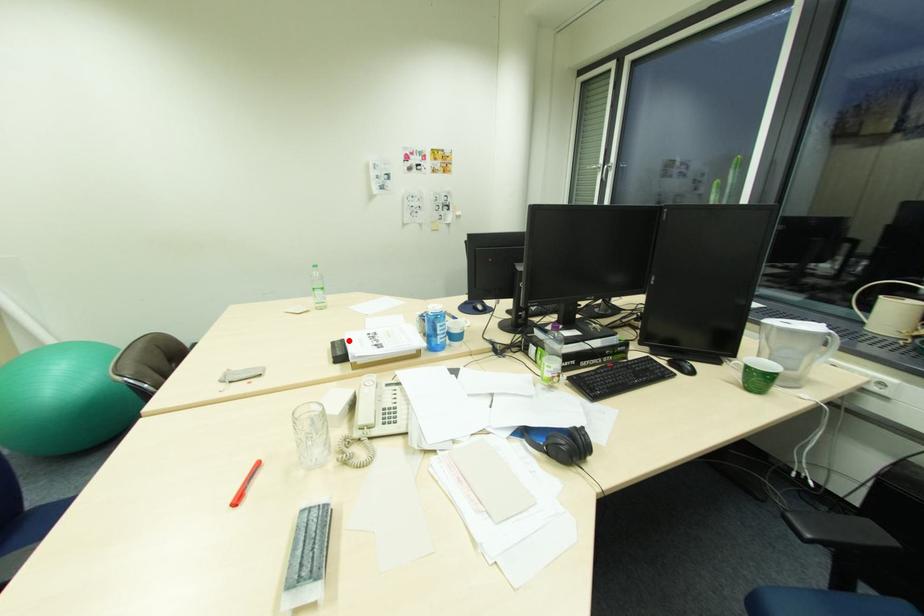
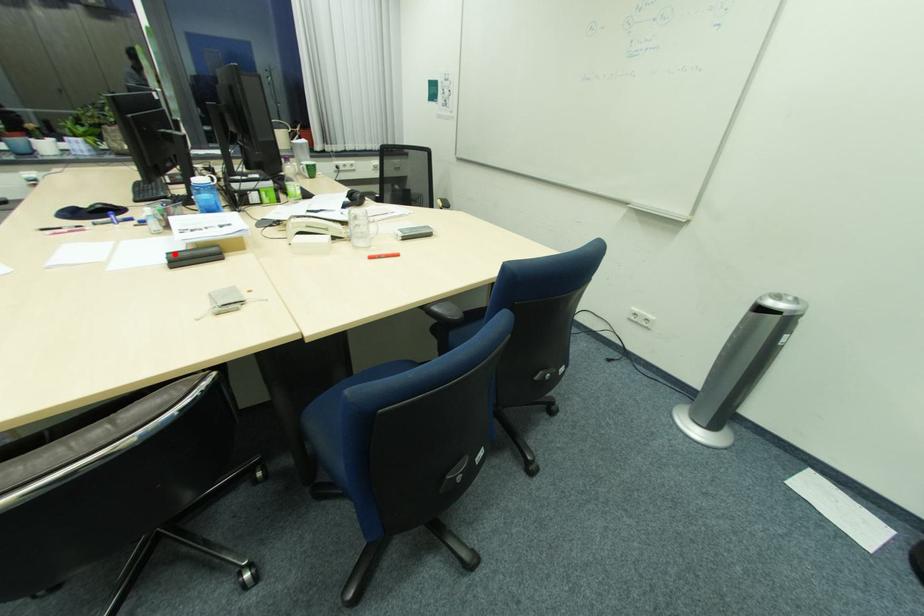
I am providing you with two images of the same scene from different viewpoints. A red point is marked on the first image and another point is marked on the second image. Is the marked point in image1 the same physical position as the marked point in image2?

Yes